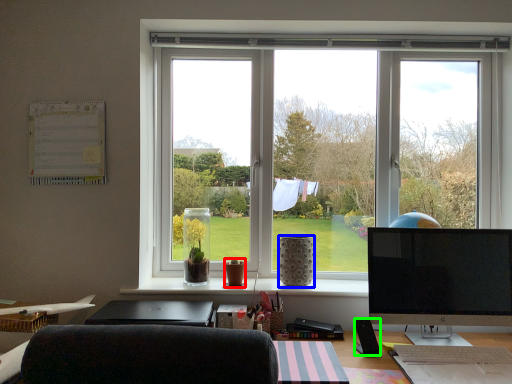
Question: Estimate the real-world distances between objects in this image. Which object is closer to vase (highlighted by a red box), vase (highlighted by a blue box) or loudspeaker (highlighted by a green box)?

Choices:
 (A) vase
 (B) loudspeaker

Answer: (A)